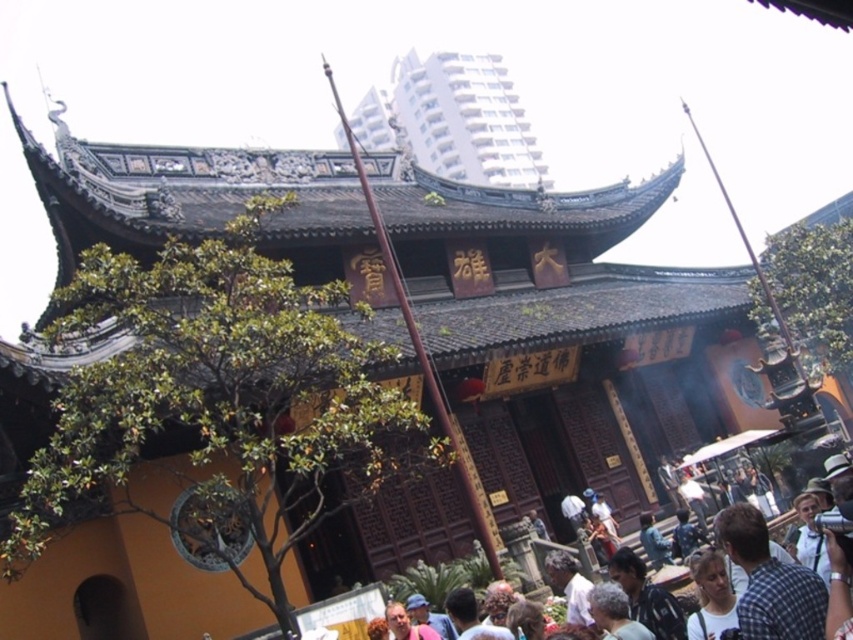
Consider the image. Does white glossy building at upper center have a greater width compared to light brown hair at lower right?

Yes, white glossy building at upper center is wider than light brown hair at lower right.

The width and height of the screenshot is (853, 640). Describe the element at coordinates (453, 120) in the screenshot. I see `white glossy building at upper center` at that location.

Find the location of `white glossy building at upper center`. white glossy building at upper center is located at coordinates (453, 120).